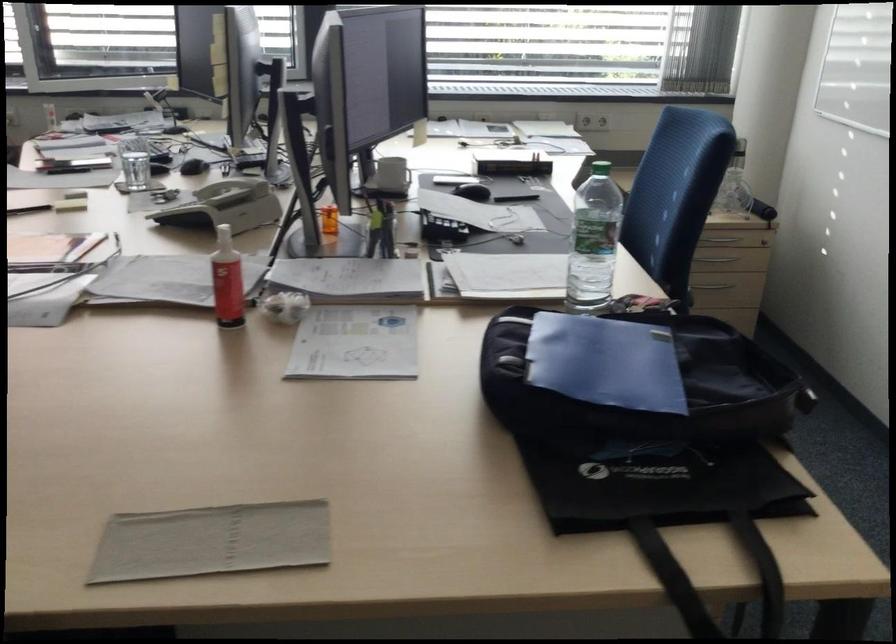
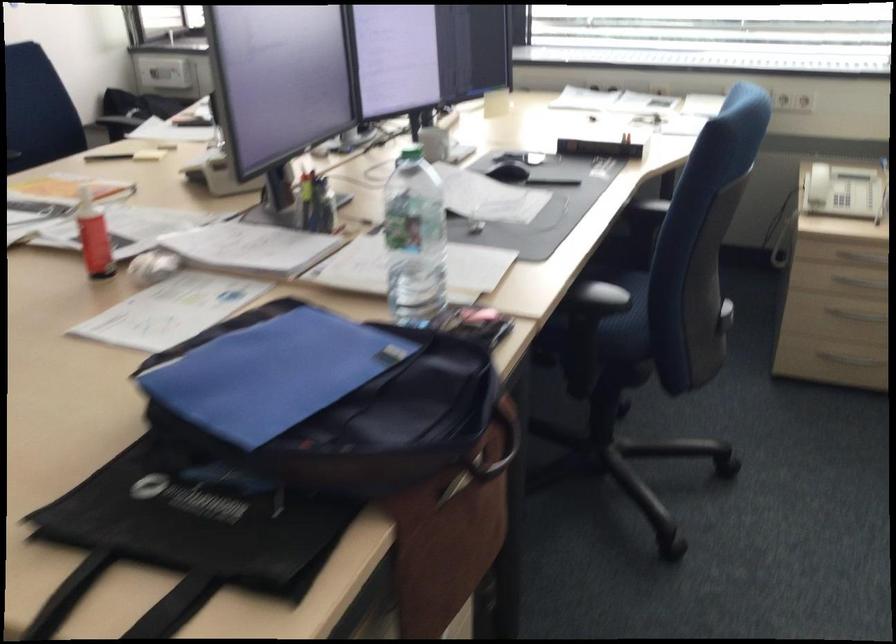
The point at (238,283) is marked in the first image. Where is the corresponding point in the second image?

(92, 236)